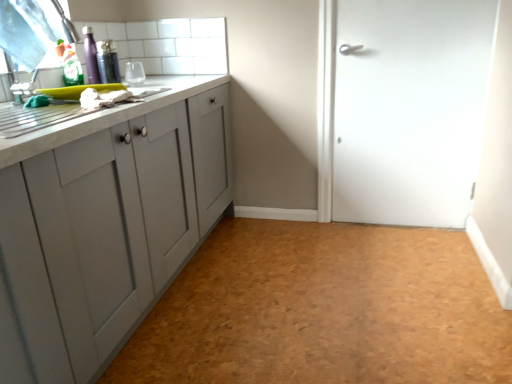
Find the location of a particular element. vacant space underneath white matte door at right (from a real-world perspective) is located at coordinates tap(397, 227).